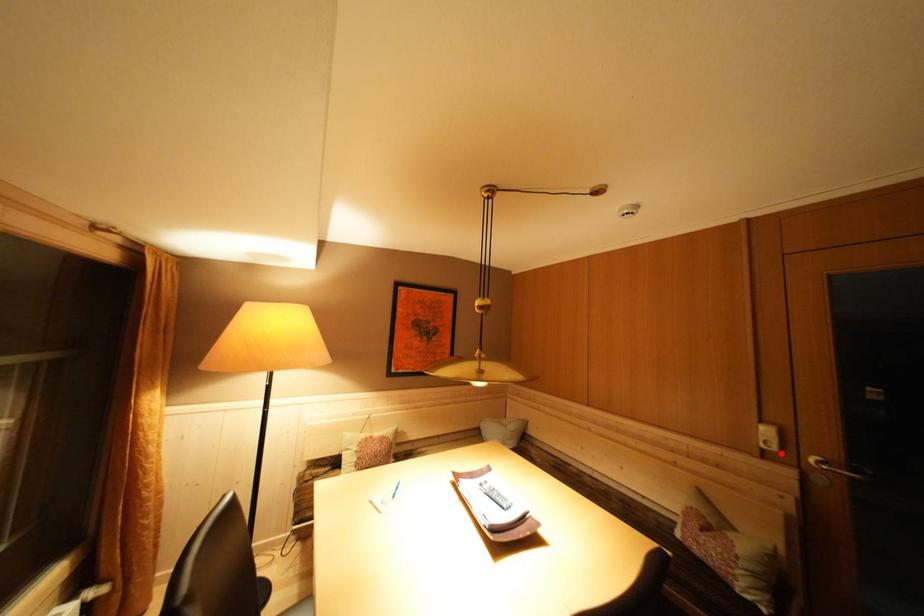
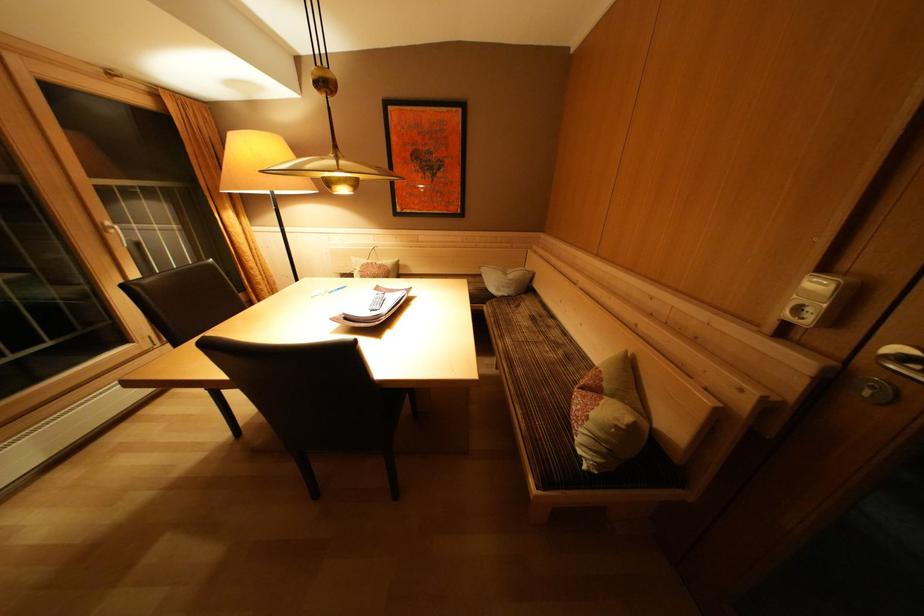
Find the pixel in the second image that matches the highlighted location in the first image.

(815, 326)